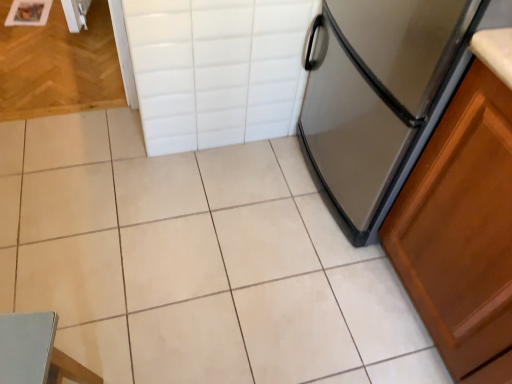
The image size is (512, 384). Find the location of `white tile drawer at upper center`. white tile drawer at upper center is located at coordinates (217, 69).

Where is `white ceramic tile at center`? white ceramic tile at center is located at coordinates (195, 262).

Is satin silver refrigerator at right to the right of white tile drawer at upper center from the viewer's perspective?

Yes.

Are satin silver refrigerator at right and white tile drawer at upper center beside each other?

No, satin silver refrigerator at right is not beside white tile drawer at upper center.

From a real-world perspective, which is physically above, satin silver refrigerator at right or white tile drawer at upper center?

From a 3D spatial view, satin silver refrigerator at right is above.

Considering the relative sizes of satin silver refrigerator at right and white tile drawer at upper center in the image provided, is satin silver refrigerator at right thinner than white tile drawer at upper center?

No, satin silver refrigerator at right is not thinner than white tile drawer at upper center.

Does point (372, 164) come farther from viewer compared to point (134, 277)?

That is False.

Is white ceramic tile at center inside satin silver refrigerator at right?

No.

Is satin silver refrigerator at right at the left side of white ceramic tile at center?

Incorrect, satin silver refrigerator at right is not on the left side of white ceramic tile at center.

Can you confirm if light blue fabric chair at lower left is positioned to the left of white ceramic tile at center?

Yes, light blue fabric chair at lower left is to the left of white ceramic tile at center.

Is white ceramic tile at center at the back of light blue fabric chair at lower left?

No.

Identify the location of ceramic tile on the right side of light blue fabric chair at lower left. (195, 262).

Between light blue fabric chair at lower left and white ceramic tile at center, which one has larger width?

With larger width is white ceramic tile at center.

From the image's perspective, is white tile drawer at upper center located above or below satin silver refrigerator at right?

Clearly, from the image's perspective, white tile drawer at upper center is above satin silver refrigerator at right.

Is white tile drawer at upper center positioned beyond the bounds of satin silver refrigerator at right?

Indeed, white tile drawer at upper center is completely outside satin silver refrigerator at right.

Is white tile drawer at upper center positioned in front of satin silver refrigerator at right?

No, white tile drawer at upper center is further to the viewer.

Is white tile drawer at upper center bigger than satin silver refrigerator at right?

Actually, white tile drawer at upper center might be smaller than satin silver refrigerator at right.

From a real-world perspective, which object rests below the other?

white ceramic tile at center is physically lower.

In the scene shown: Can you confirm if white ceramic tile at center is bigger than white tile drawer at upper center?

Yes.

Image resolution: width=512 pixels, height=384 pixels. Identify the location of drawer above the white ceramic tile at center (from the image's perspective). 217,69.

Is white ceramic tile at center to the right of white tile drawer at upper center from the viewer's perspective?

No.

In terms of height, does light blue fabric chair at lower left look taller or shorter compared to satin silver refrigerator at right?

Considering their sizes, light blue fabric chair at lower left has less height than satin silver refrigerator at right.

Between light blue fabric chair at lower left and satin silver refrigerator at right, which one has smaller size?

light blue fabric chair at lower left is smaller.

The width and height of the screenshot is (512, 384). Identify the location of chair below the satin silver refrigerator at right (from a real-world perspective). (x=36, y=352).

Would you say satin silver refrigerator at right is part of light blue fabric chair at lower left's contents?

Definitely not — satin silver refrigerator at right is not inside light blue fabric chair at lower left.

How many degrees apart are the facing directions of light blue fabric chair at lower left and white tile drawer at upper center?

The facing directions of light blue fabric chair at lower left and white tile drawer at upper center are 80.8 degrees apart.

From the image's perspective, is light blue fabric chair at lower left located beneath white tile drawer at upper center?

Correct, light blue fabric chair at lower left appears lower than white tile drawer at upper center in the image.

From a real-world perspective, is light blue fabric chair at lower left located beneath white tile drawer at upper center?

Indeed, from a real-world perspective, light blue fabric chair at lower left is positioned beneath white tile drawer at upper center.

Is light blue fabric chair at lower left at the right side of white tile drawer at upper center?

No, light blue fabric chair at lower left is not to the right of white tile drawer at upper center.

The height and width of the screenshot is (384, 512). What are the coordinates of `drawer above the satin silver refrigerator at right (from the image's perspective)` in the screenshot? It's located at (217, 69).

Find the location of a particular element. ceramic tile that appears below the satin silver refrigerator at right (from a real-world perspective) is located at coordinates (195, 262).

Considering their positions, is light blue fabric chair at lower left positioned closer to satin silver refrigerator at right than white tile drawer at upper center?

Based on the image, white tile drawer at upper center appears to be nearer to satin silver refrigerator at right.

Considering their positions, is satin silver refrigerator at right positioned further to light blue fabric chair at lower left than white ceramic tile at center?

Among the two, satin silver refrigerator at right is located further to light blue fabric chair at lower left.

Estimate the real-world distances between objects in this image. Which object is further from light blue fabric chair at lower left, white ceramic tile at center or white tile drawer at upper center?

white tile drawer at upper center.

Looking at the image, which one is located further to satin silver refrigerator at right, white ceramic tile at center or light blue fabric chair at lower left?

light blue fabric chair at lower left lies further to satin silver refrigerator at right than the other object.

From the image, which object appears to be nearer to light blue fabric chair at lower left, white tile drawer at upper center or white ceramic tile at center?

Based on the image, white ceramic tile at center appears to be nearer to light blue fabric chair at lower left.

Which object lies nearer to the anchor point white tile drawer at upper center, light blue fabric chair at lower left or satin silver refrigerator at right?

The object closer to white tile drawer at upper center is satin silver refrigerator at right.

Looking at this image, when comparing their distances from light blue fabric chair at lower left, does white ceramic tile at center or satin silver refrigerator at right seem closer?

white ceramic tile at center is closer to light blue fabric chair at lower left.

From the picture: Looking at the image, which one is located closer to satin silver refrigerator at right, white tile drawer at upper center or light blue fabric chair at lower left?

Based on the image, white tile drawer at upper center appears to be nearer to satin silver refrigerator at right.

The height and width of the screenshot is (384, 512). What are the coordinates of `drawer between light blue fabric chair at lower left and satin silver refrigerator at right in the horizontal direction` in the screenshot? It's located at (217, 69).

At what (x,y) coordinates should I click in order to perform the action: click on drawer between white ceramic tile at center and satin silver refrigerator at right. Please return your answer as a coordinate pair (x, y). The image size is (512, 384). Looking at the image, I should click on (217, 69).

Locate an element on the screen. The width and height of the screenshot is (512, 384). ceramic tile located between light blue fabric chair at lower left and satin silver refrigerator at right in the left-right direction is located at coordinates (195, 262).

This screenshot has height=384, width=512. What are the coordinates of `ceramic tile that lies between white tile drawer at upper center and light blue fabric chair at lower left from top to bottom` in the screenshot? It's located at (195, 262).